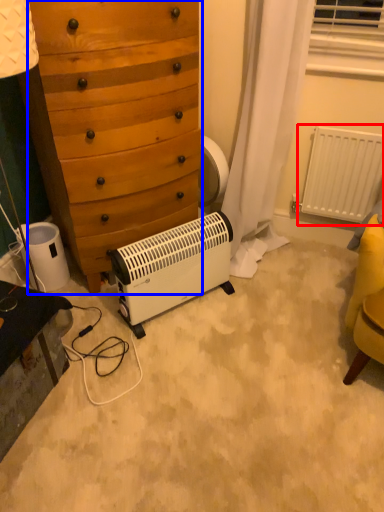
Question: Among these objects, which one is nearest to the camera, radiator (highlighted by a red box) or chest of drawers (highlighted by a blue box)?

Choices:
 (A) radiator
 (B) chest of drawers

Answer: (B)